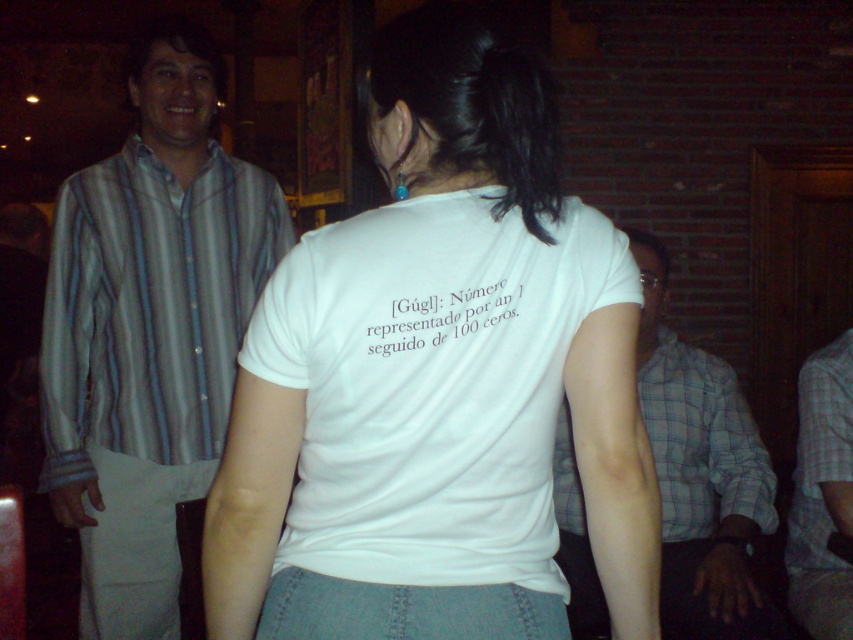
Does plaid cotton shirt at right lie behind plaid fabric shirt at right?

No, it is in front of plaid fabric shirt at right.

In the scene shown: Does plaid cotton shirt at right have a lesser height compared to plaid fabric shirt at right?

In fact, plaid cotton shirt at right may be taller than plaid fabric shirt at right.

Between point (717, 596) and point (845, 637), which one is positioned in front?

Point (845, 637)

The image size is (853, 640). Identify the location of plaid cotton shirt at right. (701, 474).

Does white matte t-shirt at center have a larger size compared to plaid fabric shirt at right?

Yes.

Between point (360, 316) and point (802, 387), which one is positioned behind?

The point (802, 387) is more distant.

This screenshot has width=853, height=640. In order to click on white matte t-shirt at center in this screenshot , I will do `click(438, 380)`.

Locate an element on the screen. white matte t-shirt at center is located at coordinates (438, 380).

Does point (62, 497) come closer to viewer compared to point (817, 522)?

Yes.

Who is more forward, (166, 556) or (804, 467)?

Point (166, 556) is more forward.

You are a GUI agent. You are given a task and a screenshot of the screen. Output one action in this format:
    pyautogui.click(x=<x>, y=<y>)
    Task: Click on the striped cotton shirt at left
    
    Given the screenshot: What is the action you would take?
    pyautogui.click(x=149, y=330)